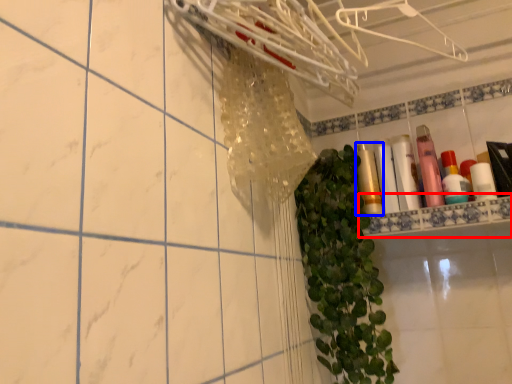
Question: Which object appears closest to the camera in this image, ledge (highlighted by a red box) or toiletry (highlighted by a blue box)?

Choices:
 (A) ledge
 (B) toiletry

Answer: (A)